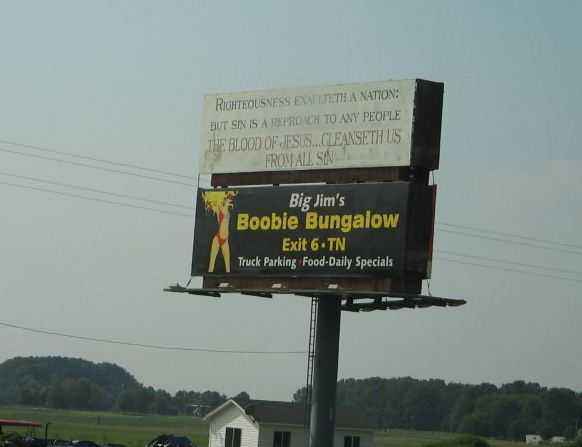
This screenshot has width=582, height=447. Find the location of `ladder`. ladder is located at coordinates (311, 373).